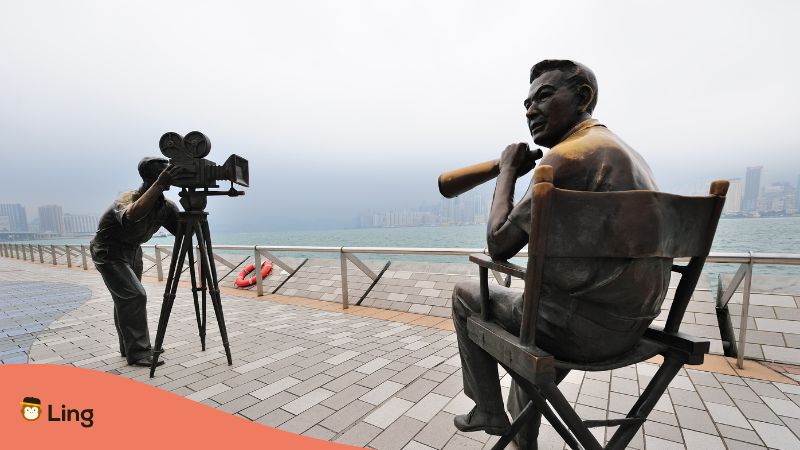
Find the location of `1 chair`. 1 chair is located at coordinates (668, 258).